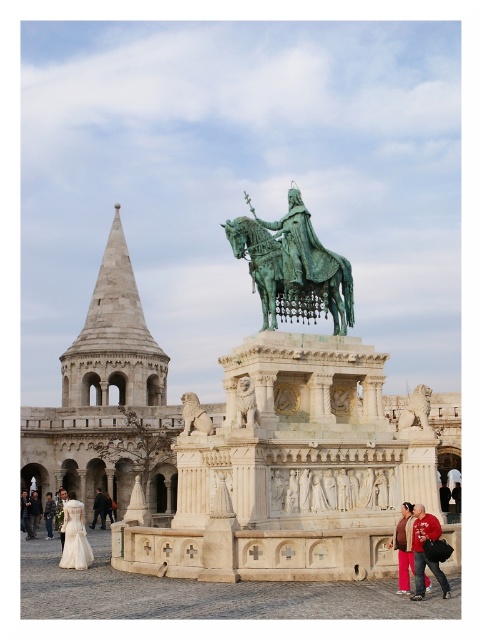
Question: Which object appears closest to the camera in this image?

Choices:
 (A) green patinated metal horse at center
 (B) white marble lion at center
 (C) red fabric jacket at lower right

Answer: (C)

Question: Is green stone lion at center positioned at the back of polished stone lion at center?

Choices:
 (A) no
 (B) yes

Answer: (A)

Question: Based on their relative distances, which object is farther from the white marble lion at center?

Choices:
 (A) polished stone lion at center
 (B) ivory satin dress at lower left
 (C) white stone tower at upper left

Answer: (C)

Question: Does white stone tower at upper left appear on the right side of white marble lion at center?

Choices:
 (A) no
 (B) yes

Answer: (A)

Question: Which point is farther from the camera taking this photo?

Choices:
 (A) (155, 365)
 (B) (68, 550)
 (C) (344, 321)
 (D) (200, 426)

Answer: (A)

Question: Does white marble lion at center have a larger size compared to polished stone lion at center?

Choices:
 (A) yes
 (B) no

Answer: (B)